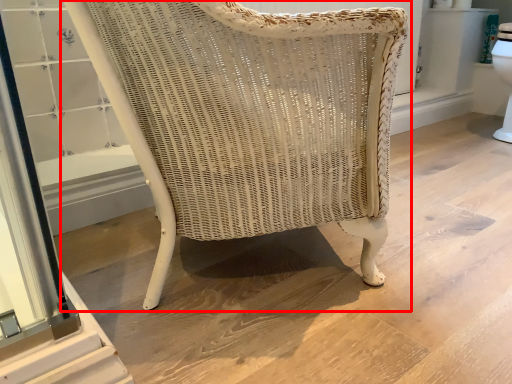
Question: Observing the image, what is the correct spatial positioning of chair (annotated by the red box) in reference to screen door?

Choices:
 (A) right
 (B) left

Answer: (A)